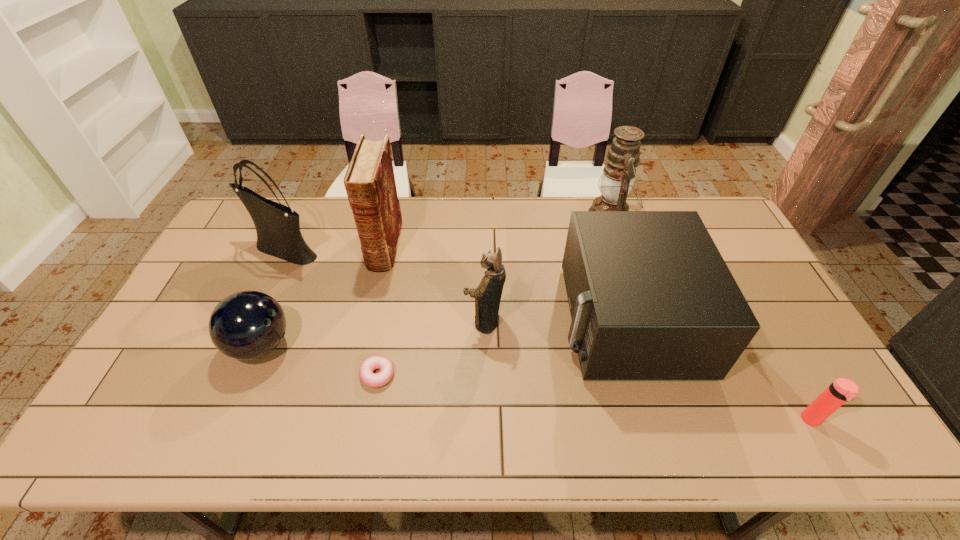
This screenshot has width=960, height=540. In the image, there is a desktop. Find the location of `free space at the far edge`. free space at the far edge is located at coordinates tap(432, 214).

Where is `vacant space at the near edge of the desktop`? The height and width of the screenshot is (540, 960). vacant space at the near edge of the desktop is located at coordinates (682, 437).

Identify the location of free region at the left edge. The width and height of the screenshot is (960, 540). (162, 379).

Locate an element on the screen. Image resolution: width=960 pixels, height=540 pixels. free space between the shortest object and the fourth shortest object is located at coordinates point(502,347).

The height and width of the screenshot is (540, 960). I want to click on vacant area that lies between the shoulder bag and the hardback book, so point(334,247).

Where is `free space between the shoulder bag and the shortest object`? free space between the shoulder bag and the shortest object is located at coordinates (331, 312).

You are a GUI agent. You are given a task and a screenshot of the screen. Output one action in this format:
    pyautogui.click(x=<x>, y=<y>)
    Task: Click on the free point between the hardback book and the figurine
    This screenshot has height=540, width=960.
    Given the screenshot: What is the action you would take?
    pyautogui.click(x=434, y=283)

You are a GUI agent. You are given a task and a screenshot of the screen. Output one action in this format:
    pyautogui.click(x=<x>, y=<y>)
    Task: Click on the empty location between the figurine and the bowling ball
    
    Given the screenshot: What is the action you would take?
    pyautogui.click(x=372, y=333)

This screenshot has height=540, width=960. I want to click on free space between the fifth tallest object and the fourth object from right to left, so click(x=556, y=321).

Select which object is the third closest to the fifth tallest object. Please provide its 2D coordinates. Your answer should be formatted as a tuple, i.e. [(x, y)], where the tuple contains the x and y coordinates of a point satisfying the conditions above.

[(842, 390)]